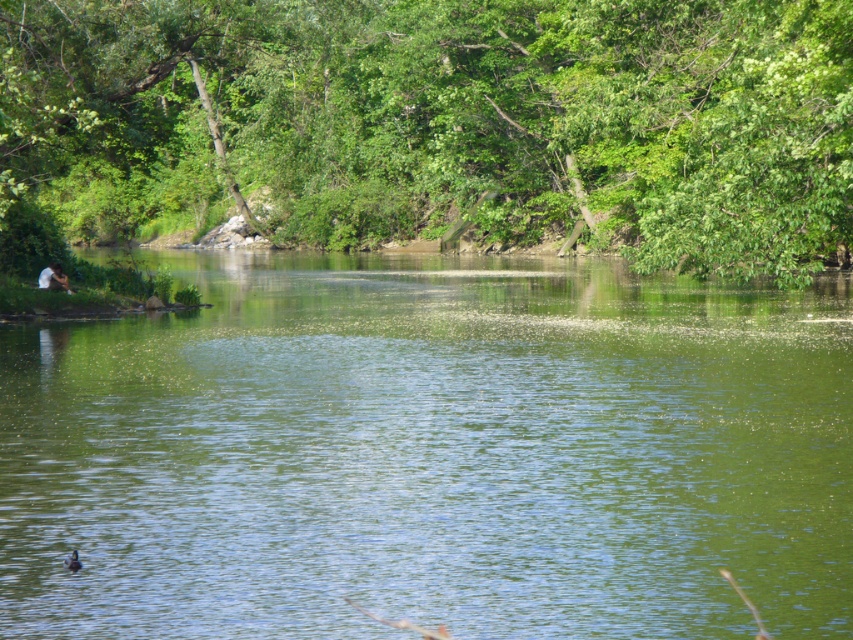
Question: Among these points, which one is nearest to the camera?

Choices:
 (A) (525, 230)
 (B) (26, 604)

Answer: (B)

Question: Estimate the real-world distances between objects in this image. Which object is farther from the green smooth water at center?

Choices:
 (A) brown fuzzy duck at lower left
 (B) green leafy tree at upper center

Answer: (A)

Question: Is green smooth water at center smaller than green leafy tree at upper center?

Choices:
 (A) yes
 (B) no

Answer: (A)

Question: Where is green smooth water at center located in relation to brown fuzzy duck at lower left in the image?

Choices:
 (A) below
 (B) above

Answer: (B)

Question: Considering the real-world distances, which object is closest to the brown fuzzy duck at lower left?

Choices:
 (A) green leafy tree at upper center
 (B) green smooth water at center

Answer: (B)

Question: Is green leafy tree at upper center bigger than brown fuzzy duck at lower left?

Choices:
 (A) no
 (B) yes

Answer: (B)